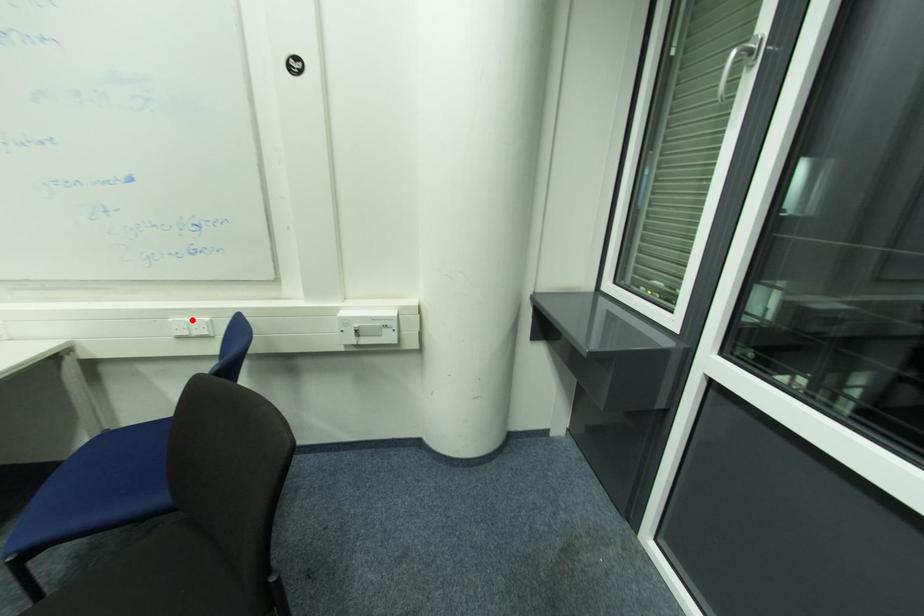
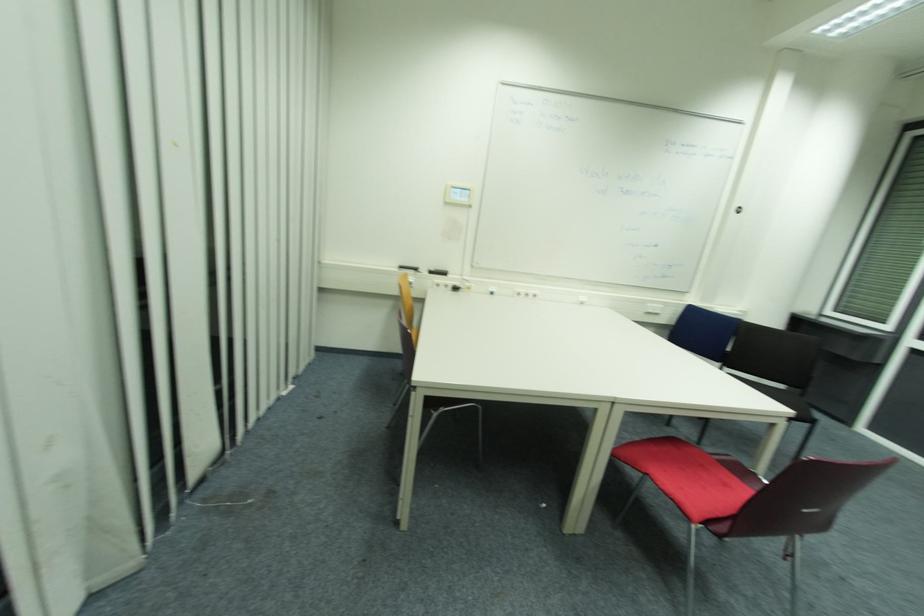
Where in the second image is the point corresponding to the highlighted location from the first image?

(658, 306)